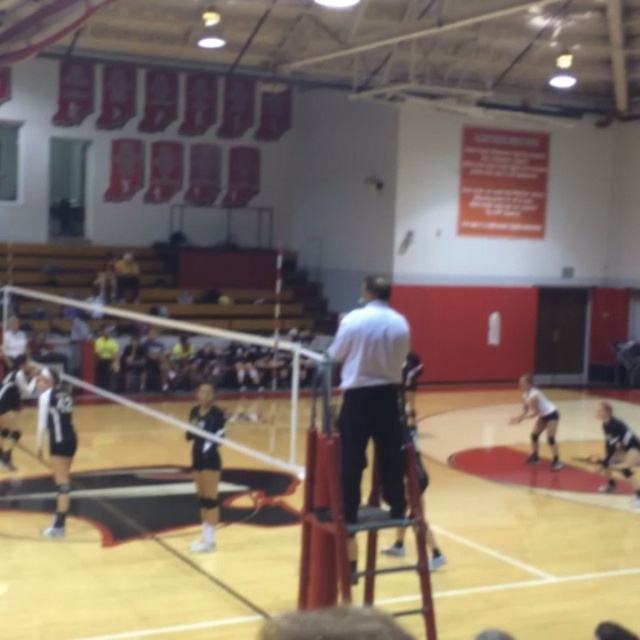
Question: Which of the following is the closest to the observer?

Choices:
 (A) white matte shirt at center
 (B) black athletic uniform at left
 (C) black uniform at center
 (D) black jersey at lower right

Answer: (A)

Question: Does black uniform at center appear over black athletic uniform at left?

Choices:
 (A) no
 (B) yes

Answer: (A)

Question: Estimate the real-world distances between objects in this image. Which object is closer to the black uniform at center?

Choices:
 (A) black athletic uniform at left
 (B) white matte shirt at center

Answer: (B)

Question: Where is black jersey at left located in relation to black uniform at center in the image?

Choices:
 (A) below
 (B) above

Answer: (B)

Question: Is black jersey at lower right to the left of white matte uniform at center from the viewer's perspective?

Choices:
 (A) no
 (B) yes

Answer: (B)

Question: Which point is farther to the camera?

Choices:
 (A) black jersey at lower right
 (B) black uniform at center
 (C) white matte shirt at center

Answer: (A)